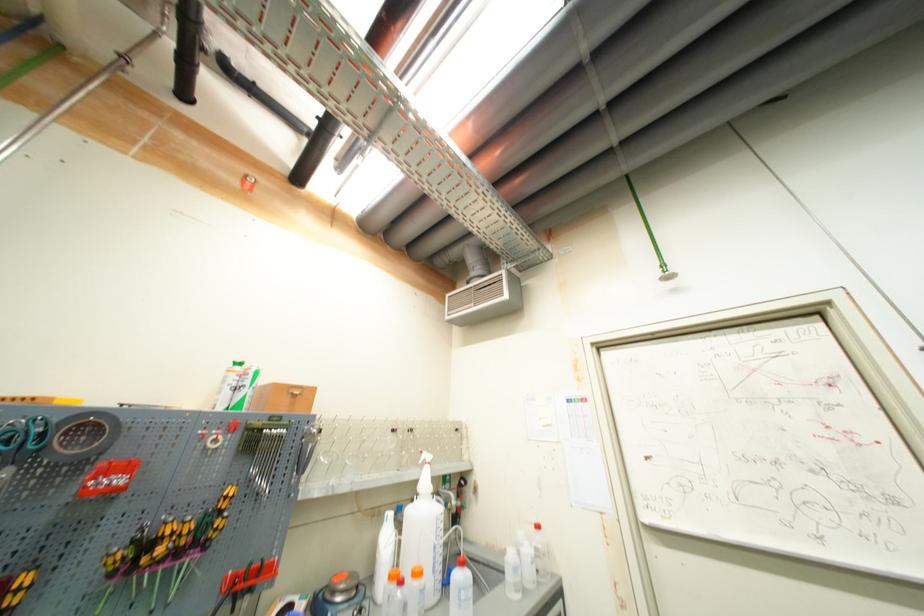
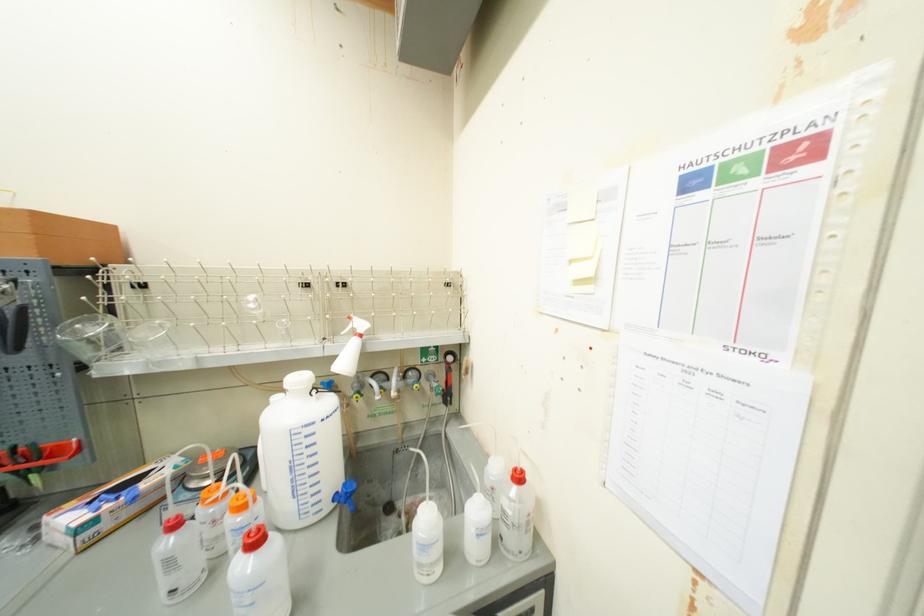
Locate, in the second image, the point that corresponds to point 545,549 in the first image.

(515, 514)